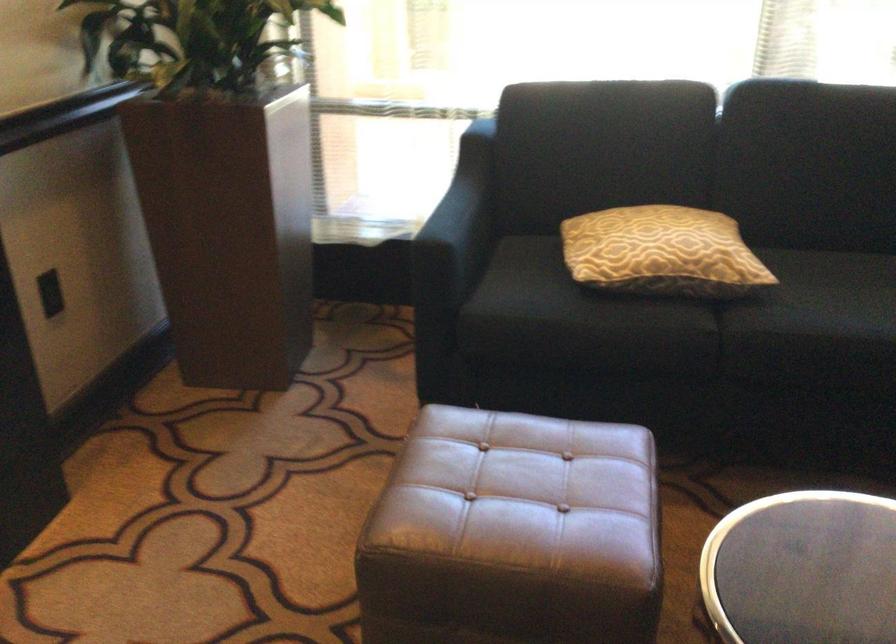
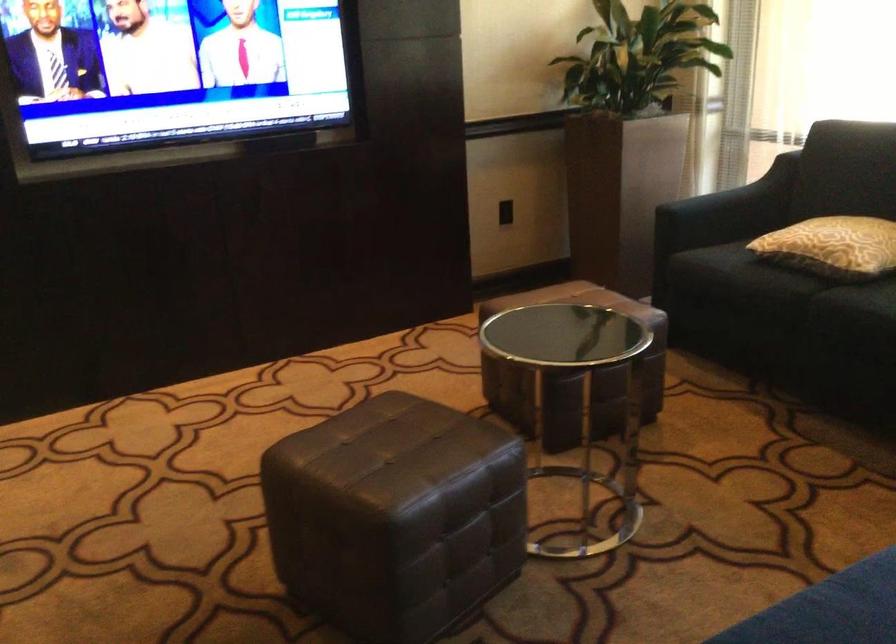
Find the pixel in the second image that matches the point at 479,211 in the first image.

(742, 196)